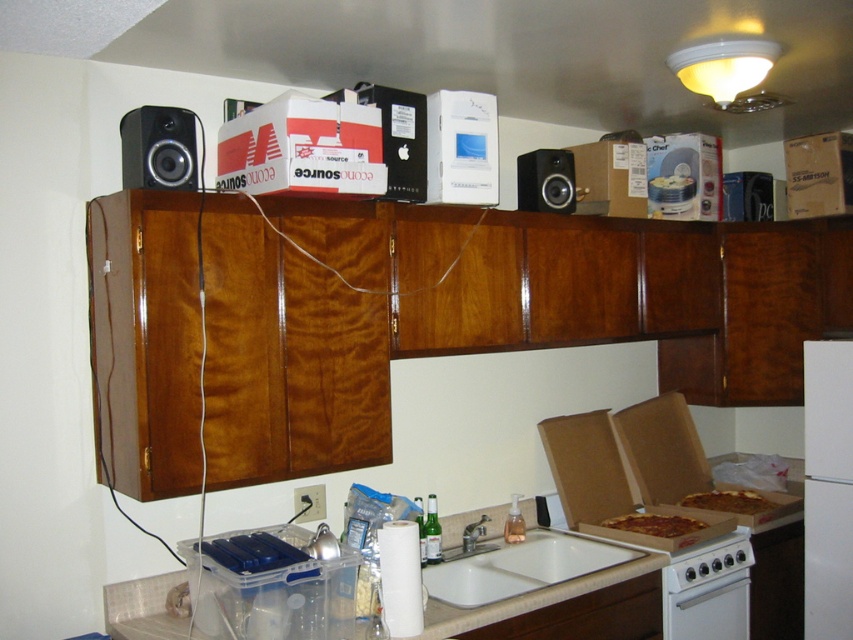
You are organizing the kitchen and need to place a new microwave on the counter. The microwave requires a space that is at least 30 cm wide. Given the current layout, can the white matte refrigerator at right be moved to accommodate this requirement?

The white matte refrigerator at right is located at point (827,488), but without specific spatial dimensions or distances between objects, it is unclear if moving it would provide enough space. Check the available counter space before deciding.

You are organizing the items on the kitchen counter. You need to place the matte black speaker at upper center and the golden crispy pizza at lower right. According to their positions, which item is located to the left of the other?

The matte black speaker at upper center is positioned on the left side of golden crispy pizza at lower right.

You are trying to determine which appliance is taller between the white ceramic sink at lower center and the white glossy oven at lower right. Based on the scene description, which one is taller?

The white glossy oven at lower right is taller than the white ceramic sink at lower center.